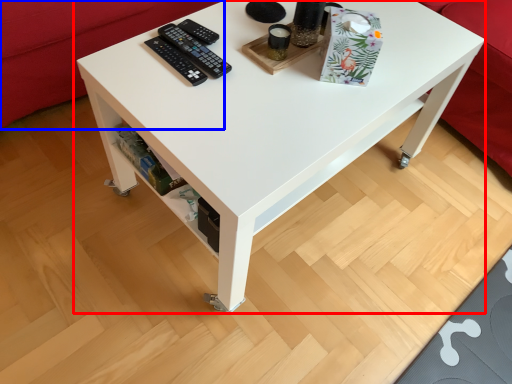
Question: Which object appears closest to the camera in this image, table (highlighted by a red box) or couch (highlighted by a blue box)?

Choices:
 (A) table
 (B) couch

Answer: (A)